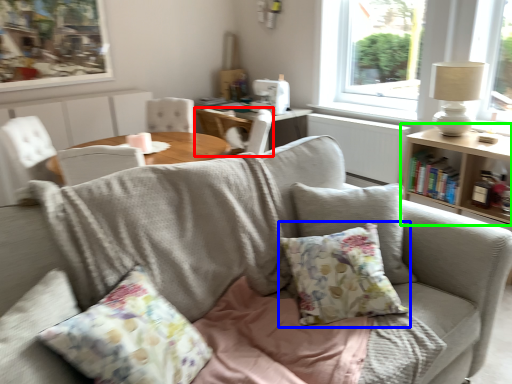
Question: Which object is positioned farthest from chair (highlighted by a red box)? Select from pillow (highlighted by a blue box) and table (highlighted by a green box).

Choices:
 (A) pillow
 (B) table

Answer: (A)